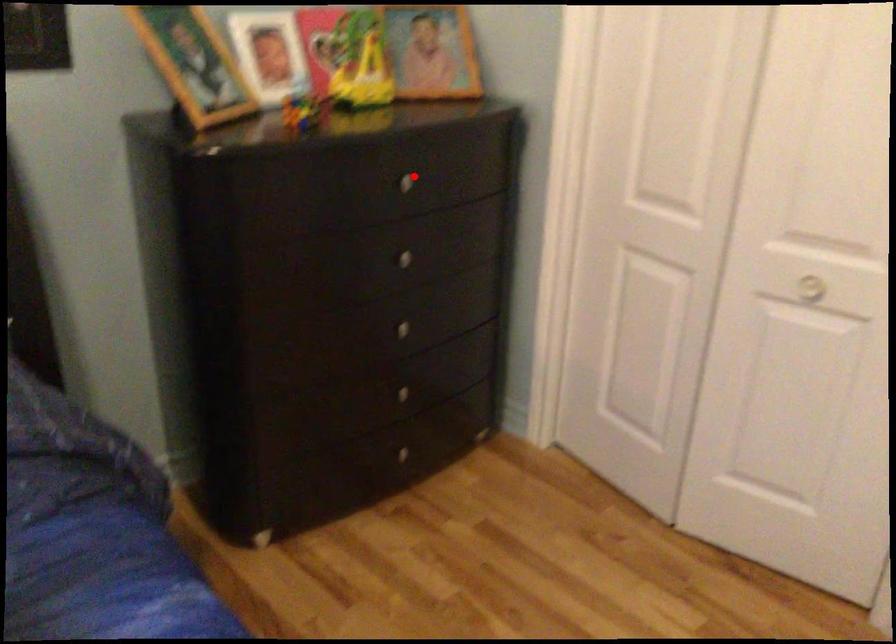
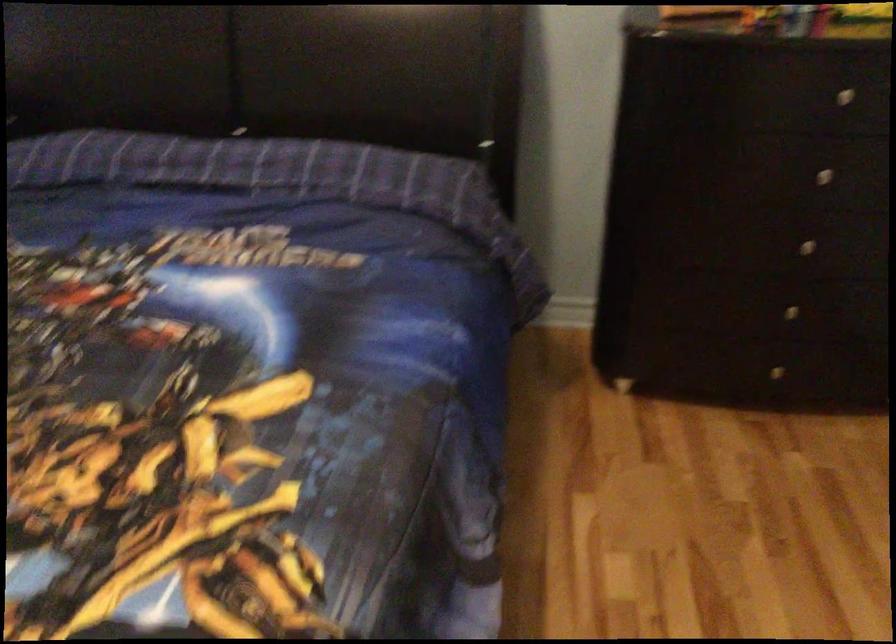
The point at the highlighted location is marked in the first image. Where is the corresponding point in the second image?

(858, 91)